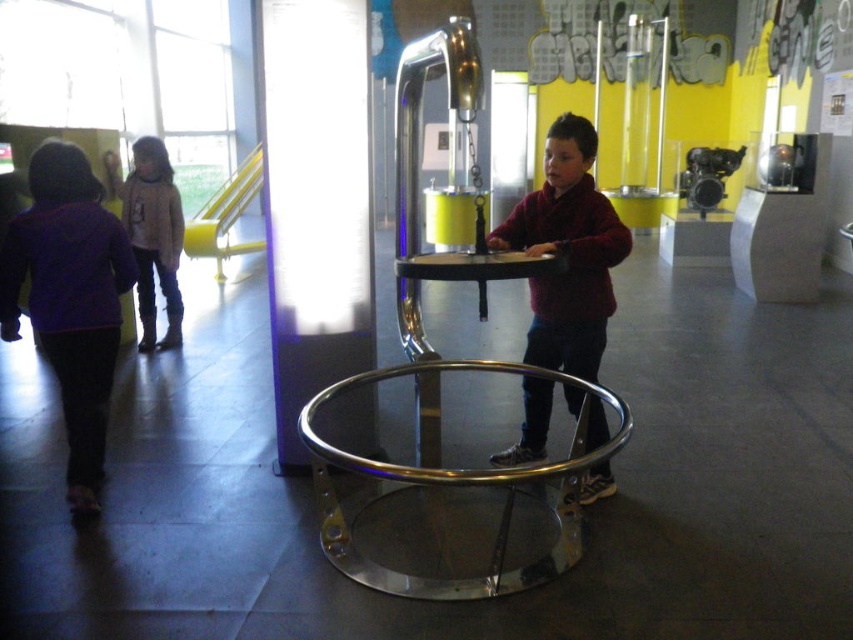
You are a security guard at the museum and need to ensure visitors are not too close to the exhibit. The safety rule states that visitors must stay at least 1 meter away from the central metallic structure. You see the maroon sweater at center and the matte gray sweater at left. Which visitor is closer to the central metallic structure?

The maroon sweater at center is closer to the central metallic structure than the matte gray sweater at left because the maroon sweater at center is positioned below it, indicating a closer proximity.

You are a tour guide at the museum and need to ensure visitors stay at least 2 meters away from the interactive exhibits for safety. A visitor wearing a maroon sweater at center is currently standing near the exhibit. Is the visitor compliant with the safety distance requirement?

The distance of maroon sweater at center from camera is 2.55 meters, which is more than the required 2 meters, so the visitor is compliant with the safety distance requirement.

In the scene shown: You are a museum guide and need to ensure visitors are spaced appropriately. The minimum required distance between visitors is 1.5 meters. Given that the purple fleece jacket at left is closer to the maroon sweater at center than 1.5 meters, can you confirm if they are maintaining the required distance?

The purple fleece jacket at left is closer to the maroon sweater at center than the required 1.5 meters, so they are not maintaining the required distance.